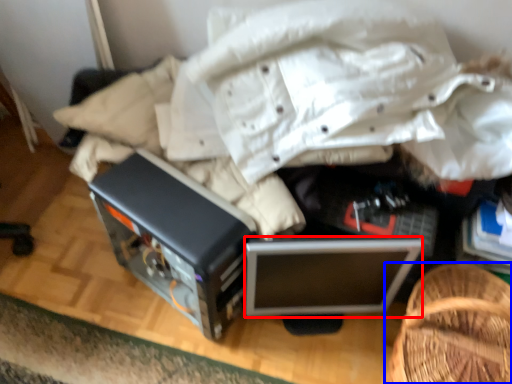
Question: Among these objects, which one is nearest to the camera, computer (highlighted by a red box) or furniture (highlighted by a blue box)?

Choices:
 (A) computer
 (B) furniture

Answer: (B)